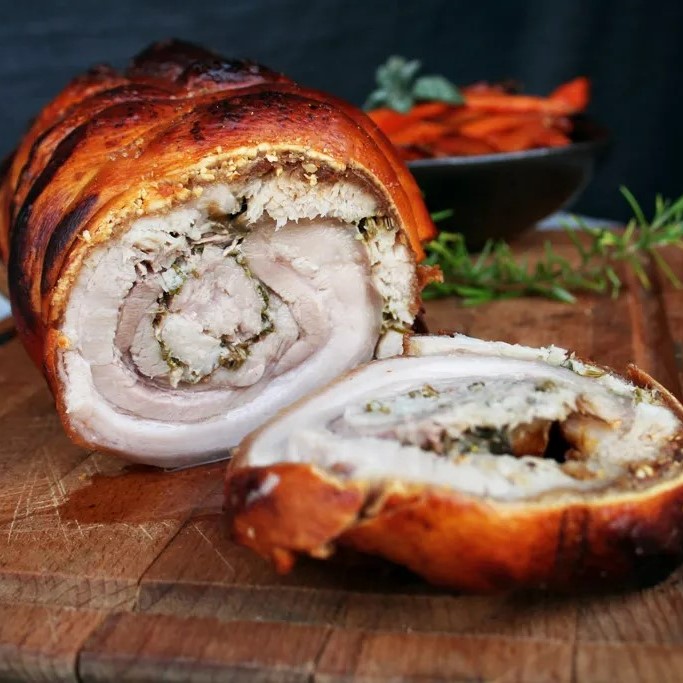
The image size is (683, 683). Identify the location of blurry food product in the bowl. (473, 128).